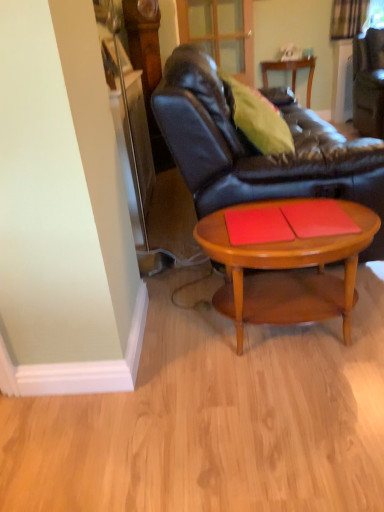
Locate an element on the screen. vacant space underneath red matte placemat at center, the first plank from the right (from a real-world perspective) is located at coordinates (309, 219).